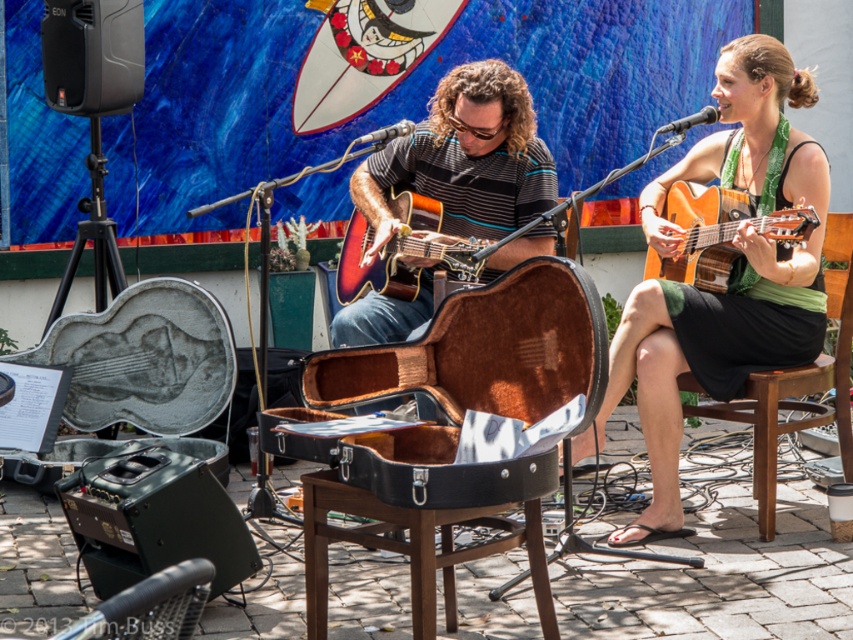
Question: Considering the real-world distances, which object is farthest from the sunburst wood guitar at center?

Choices:
 (A) acoustic wood guitar at right
 (B) brown wood stool at center
 (C) green fabric dress at center

Answer: (B)

Question: Which is nearer to the brown wood stool at center?

Choices:
 (A) sunburst wood guitar at center
 (B) wooden chair at center
 (C) green fabric dress at center
 (D) acoustic wood guitar at right

Answer: (C)

Question: Where is brown wood stool at center located in relation to sunburst wood guitar at center in the image?

Choices:
 (A) above
 (B) below

Answer: (B)

Question: Which point is farther to the camera?

Choices:
 (A) (781, 220)
 (B) (670, 339)
 (C) (357, 532)
 (D) (469, 280)

Answer: (D)

Question: Is acoustic wood guitar at right smaller than sunburst wood guitar at center?

Choices:
 (A) yes
 (B) no

Answer: (B)

Question: Is green fabric dress at center closer to camera compared to sunburst wood guitar at center?

Choices:
 (A) no
 (B) yes

Answer: (B)